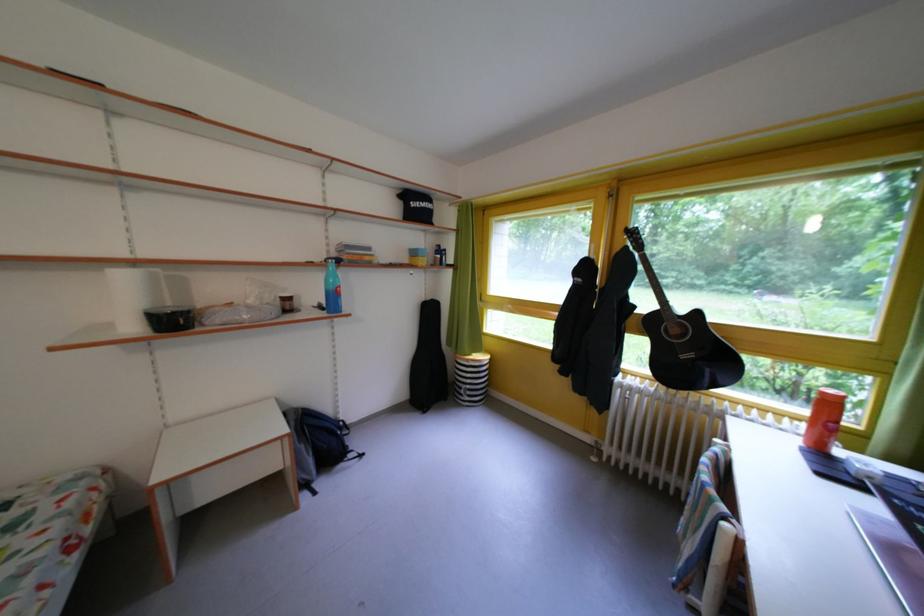
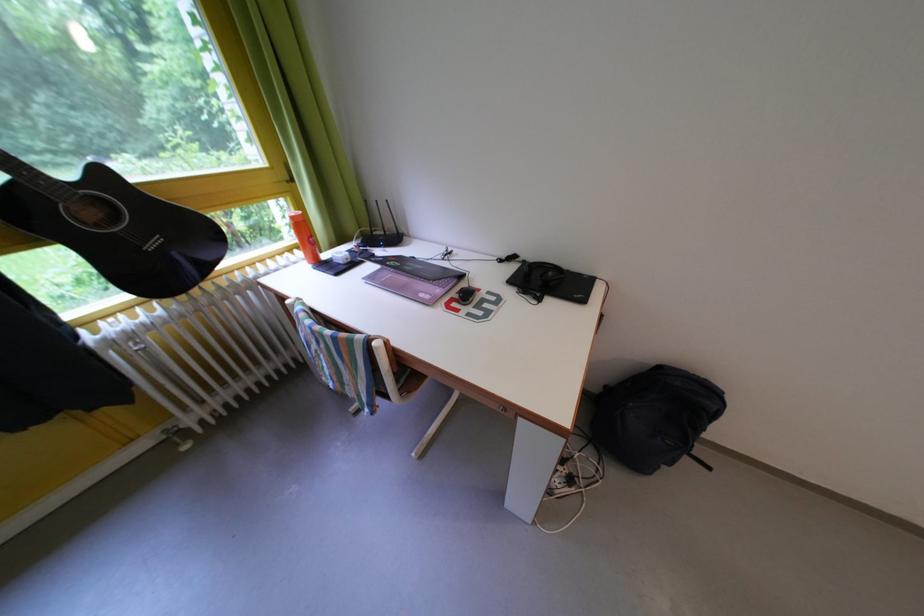
The images are taken continuously from a first-person perspective. In which direction is your viewpoint rotating?

The rotation direction of the camera is right-down.